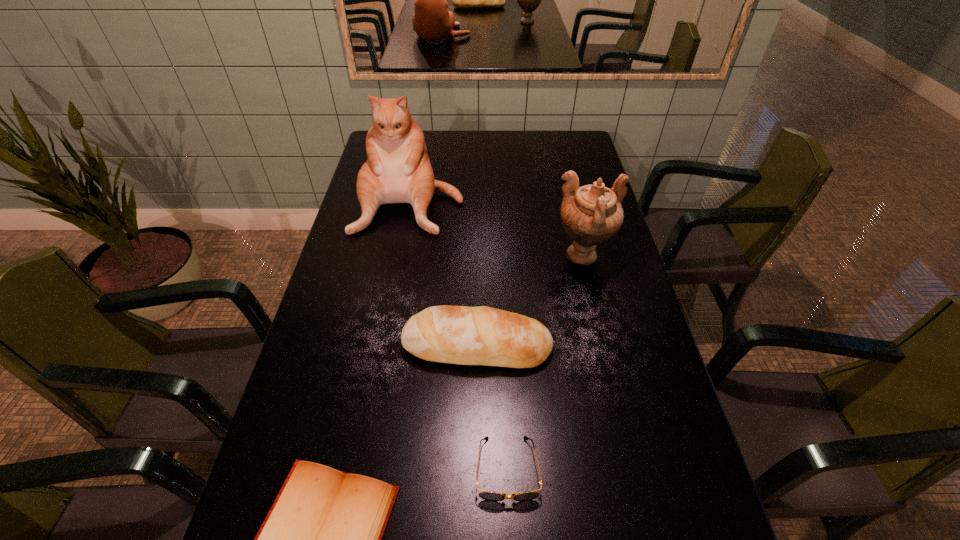
Locate an element on the screen. vacant space situated 0.050m on the lenses of the second shortest object is located at coordinates (510, 532).

I want to click on object located in the left edge section of the desktop, so click(x=398, y=170).

Find the location of a particular element. Image resolution: width=960 pixels, height=540 pixels. object that is at the right edge is located at coordinates (592, 214).

In the image, there is a desktop. Where is `vacant space at the left edge`? The width and height of the screenshot is (960, 540). vacant space at the left edge is located at coordinates (382, 238).

In order to click on free space at the right edge of the desktop in this screenshot , I will do `click(633, 329)`.

At what (x,y) coordinates should I click in order to perform the action: click on free space at the far right corner. Please return your answer as a coordinate pair (x, y). This screenshot has height=540, width=960. Looking at the image, I should click on (568, 155).

I want to click on vacant area that lies between the fourth tallest object and the urn, so click(x=545, y=363).

Find the location of a particular element. This screenshot has width=960, height=540. unoccupied area between the third farthest object and the sunglasses is located at coordinates (492, 407).

Where is `vacant space that's between the tallest object and the third tallest object`? vacant space that's between the tallest object and the third tallest object is located at coordinates (444, 273).

Identify the location of vacant point located between the fourth tallest object and the third tallest object. The height and width of the screenshot is (540, 960). (492, 407).